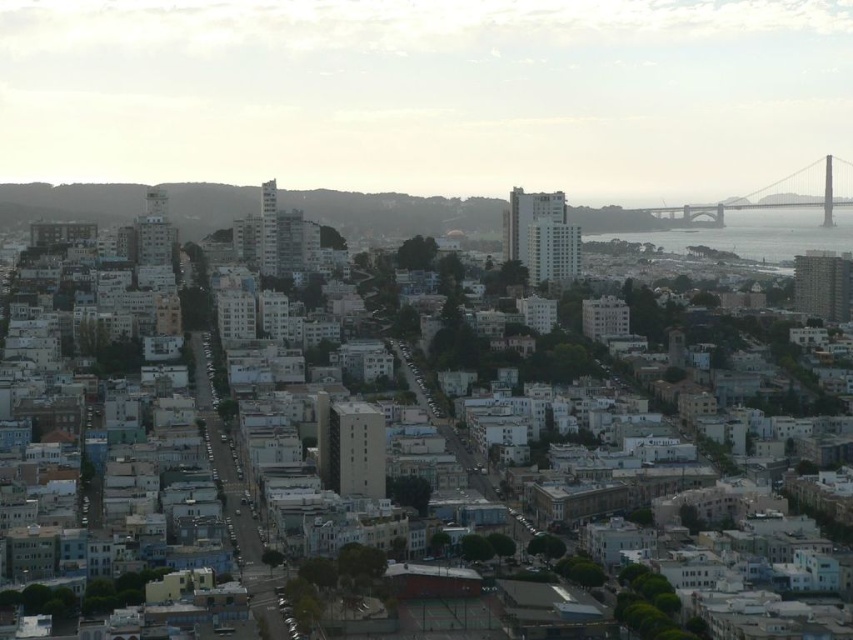
Question: Is clear water at lower right closer to the viewer compared to gray concrete bridge at upper right?

Choices:
 (A) no
 (B) yes

Answer: (B)

Question: Which object appears closest to the camera in this image?

Choices:
 (A) gray concrete bridge at upper right
 (B) clear water at lower right

Answer: (B)

Question: Is clear water at lower right smaller than gray concrete bridge at upper right?

Choices:
 (A) yes
 (B) no

Answer: (A)

Question: Which object appears farthest from the camera in this image?

Choices:
 (A) gray concrete bridge at upper right
 (B) clear water at lower right

Answer: (A)

Question: Can you confirm if clear water at lower right is positioned to the right of gray concrete bridge at upper right?

Choices:
 (A) yes
 (B) no

Answer: (B)

Question: Which of the following is the closest to the observer?

Choices:
 (A) (811, 205)
 (B) (809, 227)

Answer: (B)